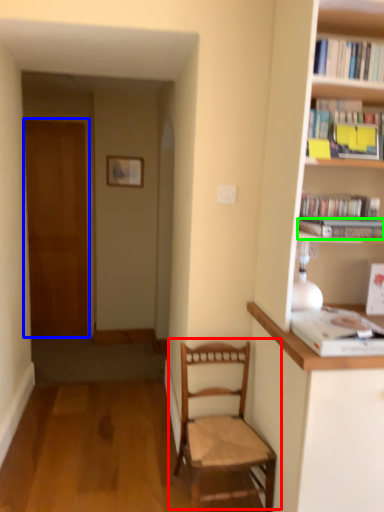
Question: Considering the real-world distances, which object is closest to chair (highlighted by a red box)? door (highlighted by a blue box) or book (highlighted by a green box).

Choices:
 (A) door
 (B) book

Answer: (B)